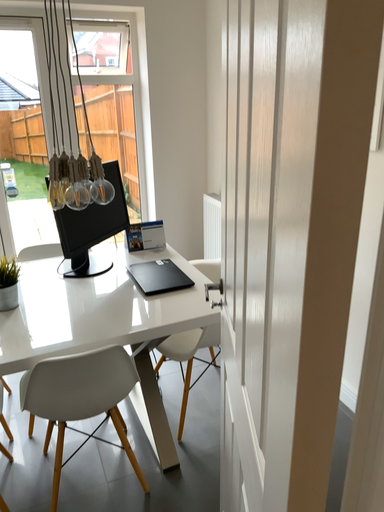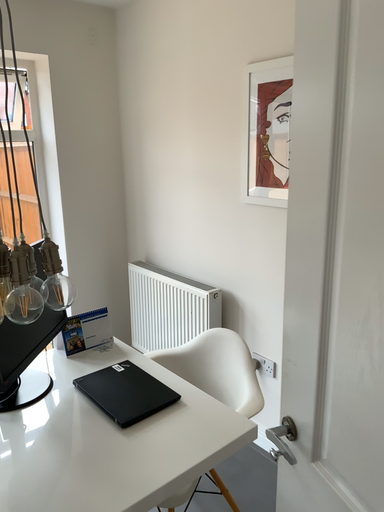
Question: How did the camera likely rotate when shooting the video?

Choices:
 (A) rotated left
 (B) rotated right

Answer: (B)